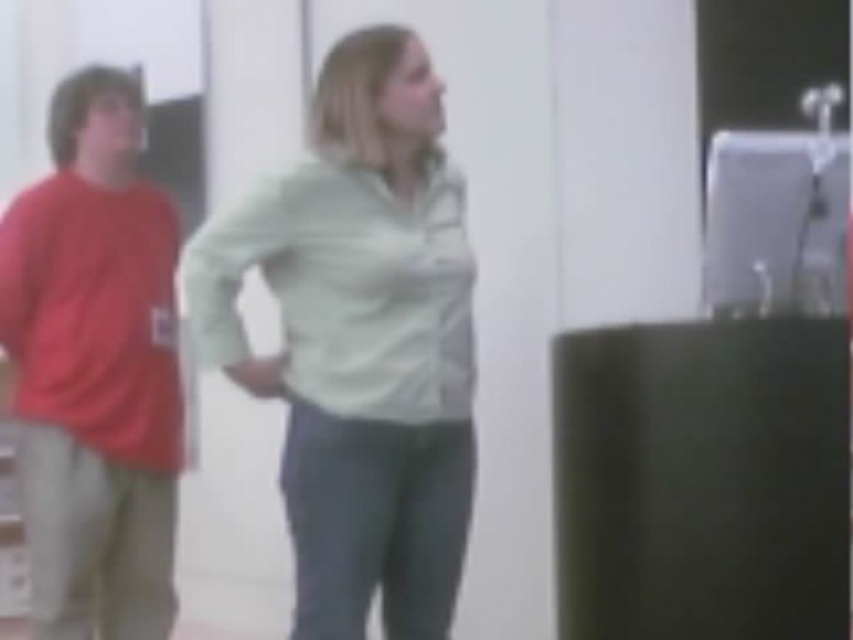
You are a photographer standing at a certain position. You want to capture a portrait of the light green fabric shirt at center. What is the minimum distance you need to move forward or backward to ensure the subject fills the frame properly? Assume your camera requires the subject to be exactly 2 meters away for optimal framing.

The light green fabric shirt at center is currently 1.92 meters away from the camera. To achieve the required 2 meters distance for optimal framing, you need to move backward by 0.08 meters.

You are organizing a clothing donation drive and need to determine if the matte red shirt at left and the light green cotton shirt at center can fit side by side on a shelf that is 1.2 meters wide. Based on their widths, will they fit?

The matte red shirt at left has a lesser width compared to light green cotton shirt at center. Since the total width of both shirts combined is less than 1.2 meters, they can fit side by side on the shelf.